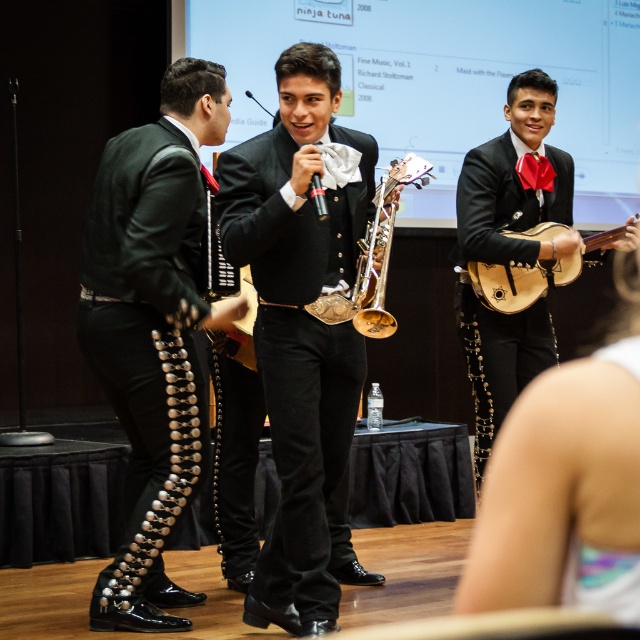
Can you confirm if shiny black suit at center is shorter than green shiny vest at left?

Yes.

You are a GUI agent. You are given a task and a screenshot of the screen. Output one action in this format:
    pyautogui.click(x=<x>, y=<y>)
    Task: Click on the shiny black suit at center
    
    Given the screenshot: What is the action you would take?
    point(301,336)

Is shiny black suit at center shorter than gold brass trumpet at center?

Incorrect, shiny black suit at center's height does not fall short of gold brass trumpet at center's.

From the picture: Can you confirm if shiny black suit at center is taller than gold brass trumpet at center?

Yes, shiny black suit at center is taller than gold brass trumpet at center.

Between point (227, 163) and point (360, 323), which one is positioned behind?

The point (360, 323) is behind.

You are a GUI agent. You are given a task and a screenshot of the screen. Output one action in this format:
    pyautogui.click(x=<x>, y=<y>)
    Task: Click on the shiny black suit at center
    
    Given the screenshot: What is the action you would take?
    pyautogui.click(x=301, y=336)

Is point (160, 548) positioned after point (550, 225)?

No.

Can you confirm if green shiny vest at left is positioned below wooden mandolin at right?

Yes, green shiny vest at left is below wooden mandolin at right.

Which is behind, point (92, 625) or point (582, 244)?

Positioned behind is point (582, 244).

Where is `green shiny vest at left`? This screenshot has height=640, width=640. green shiny vest at left is located at coordinates (152, 330).